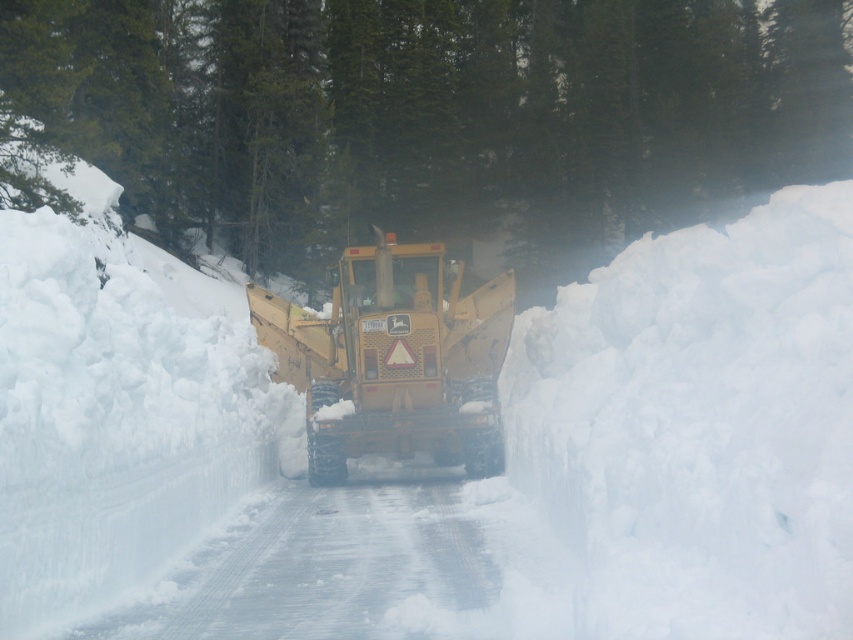
Question: In this image, where is green matte tree at upper center located relative to metallic yellow snowplow at center?

Choices:
 (A) left
 (B) right

Answer: (B)

Question: Can you confirm if green matte tree at upper center is positioned to the right of metallic yellow snowplow at center?

Choices:
 (A) yes
 (B) no

Answer: (A)

Question: Is green matte tree at upper center to the left of metallic yellow snowplow at center from the viewer's perspective?

Choices:
 (A) no
 (B) yes

Answer: (A)

Question: Which point is farther to the camera?

Choices:
 (A) (352, 294)
 (B) (88, 93)

Answer: (B)